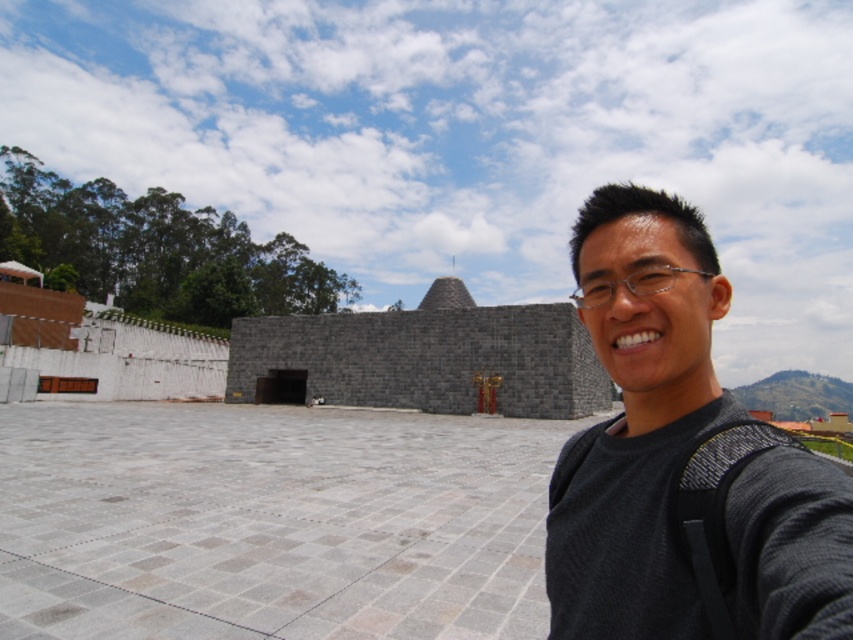
You are standing at the point with coordinates point (258, 321) and want to walk to the point with coordinates point (808, 612). Which direction should you move to get closer to your destination?

You should move forward because point (808, 612) is in front of point (258, 321).

You are a photographer trying to capture the gray stone pyramid at center without any obstructions. You notice the black fabric at right in your shot. Can you move to the left to avoid it?

The black fabric at right is in front of the gray stone pyramid at center, so moving to the left may not eliminate the obstruction since the fabric is already blocking the pyramid from that angle. Consider moving to the right or adjusting your camera angle instead.